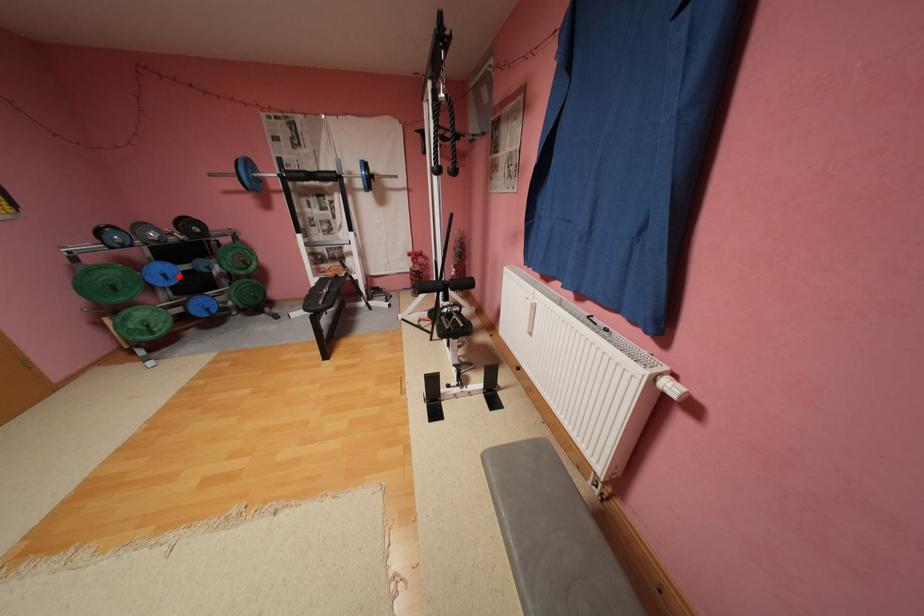
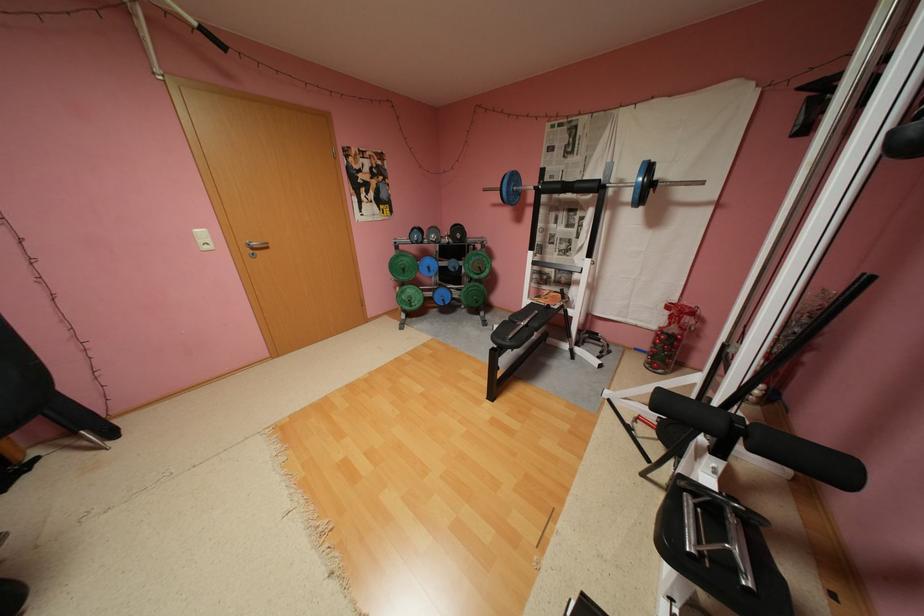
Locate, in the second image, the point that corresponds to the highlighted location in the first image.

(441, 269)